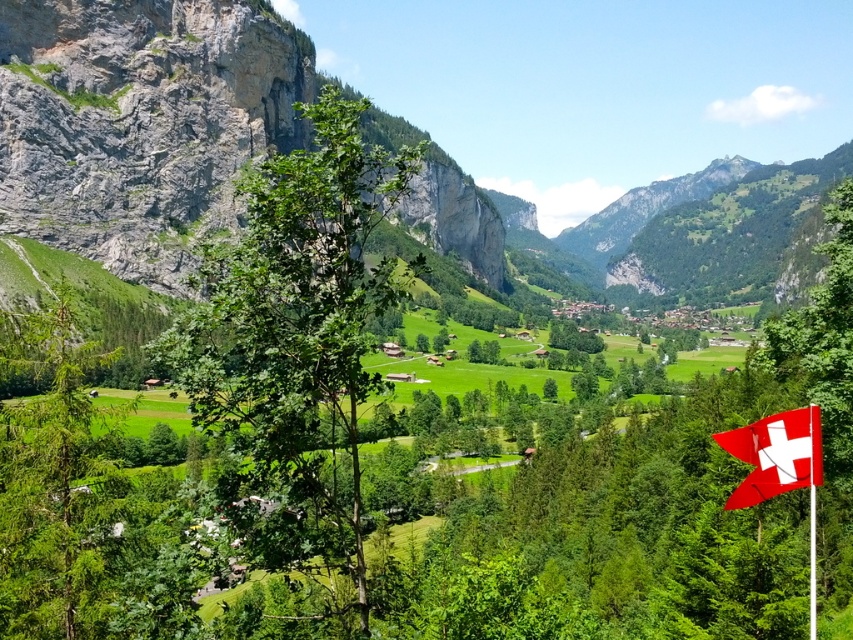
You are a hiker who wants to take a photo of the red fabric flag at lower right while standing near the green matte tree at left. Can you see the flag from your current position?

The green matte tree at left is above the red fabric flag at lower right, so yes, you can see the flag from your current position as the tree is positioned above it and not blocking the view.